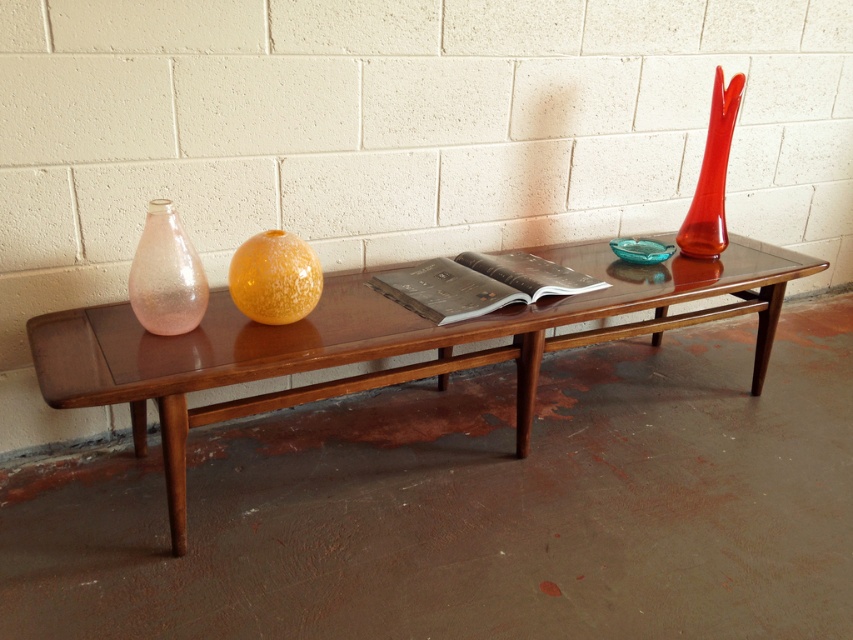
Question: Is translucent amber sphere at center positioned at the back of translucent red glass vase at right?

Choices:
 (A) no
 (B) yes

Answer: (A)

Question: Which is nearer to the translucent amber sphere at center?

Choices:
 (A) translucent red glass vase at right
 (B) glossy wood table at center
 (C) translucent pink glass vase at left

Answer: (C)

Question: Which object appears farthest from the camera in this image?

Choices:
 (A) glossy wood table at center
 (B) translucent amber sphere at center
 (C) translucent pink glass vase at left

Answer: (B)

Question: Does glossy wood table at center appear over translucent amber sphere at center?

Choices:
 (A) yes
 (B) no

Answer: (B)

Question: Is translucent amber sphere at center positioned before translucent red glass vase at right?

Choices:
 (A) no
 (B) yes

Answer: (B)

Question: Which point is closer to the camera taking this photo?

Choices:
 (A) (149, 230)
 (B) (300, 259)

Answer: (A)